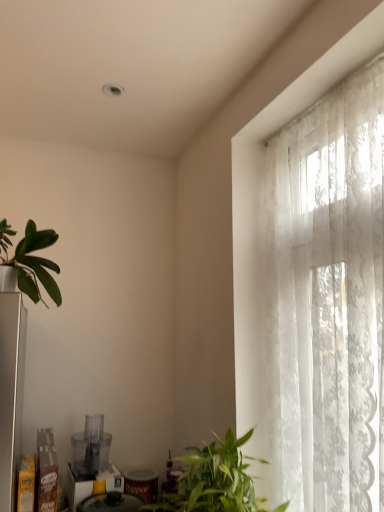
I want to click on transparent plastic food processor at lower left, which appears as the first appliance when viewed from the top, so click(91, 447).

The image size is (384, 512). Find the location of `matte plastic blender at lower left, the first appliance when ordered from bottom to top`. matte plastic blender at lower left, the first appliance when ordered from bottom to top is located at coordinates (92, 463).

What is the approximate height of green matte plant at left, marked as the second houseplant in a bottom-to-top arrangement?

33.61 centimeters.

Describe the element at coordinates (31, 261) in the screenshot. I see `green matte plant at left, the second houseplant when ordered from front to back` at that location.

Identify the location of white lace curtain at right. (327, 301).

Measure the distance between green leafy plant at lower right, placed as the 2th houseplant when sorted from left to right, and camera.

4.01 feet.

This screenshot has width=384, height=512. I want to click on green leafy plant at lower right, which is the first houseplant from front to back, so click(x=213, y=481).

At what (x,y) coordinates should I click in order to perform the action: click on transparent plastic food processor at lower left, which appears as the first appliance when viewed from the top. Please return your answer as a coordinate pair (x, y). The image size is (384, 512). Looking at the image, I should click on (91, 447).

Is green matte plant at left, marked as the second houseplant in a bottom-to-top arrangement, oriented towards transparent plastic food processor at lower left, which is the 2th appliance in bottom-to-top order?

No, green matte plant at left, marked as the second houseplant in a bottom-to-top arrangement, is not turned towards transparent plastic food processor at lower left, which is the 2th appliance in bottom-to-top order.

Considering the sizes of objects green matte plant at left, which is the first houseplant from back to front, and transparent plastic food processor at lower left, which is the 2th appliance in bottom-to-top order, in the image provided, who is taller, green matte plant at left, which is the first houseplant from back to front, or transparent plastic food processor at lower left, which is the 2th appliance in bottom-to-top order,?

green matte plant at left, which is the first houseplant from back to front, is taller.

From the image's perspective, which one is positioned higher, green matte plant at left, which ranks as the 2th houseplant in right-to-left order, or transparent plastic food processor at lower left, which appears as the first appliance when viewed from the top?

green matte plant at left, which ranks as the 2th houseplant in right-to-left order.

Is point (8, 244) in front of point (82, 465)?

Yes, point (8, 244) is in front of point (82, 465).

Between point (50, 239) and point (100, 465), which one is positioned behind?

The point (100, 465) is farther.

From the image's perspective, is green matte plant at left, the 1th houseplant from the left, below matte plastic blender at lower left, the first appliance when ordered from bottom to top?

No, from the image's perspective, green matte plant at left, the 1th houseplant from the left, is not beneath matte plastic blender at lower left, the first appliance when ordered from bottom to top.

Is the depth of white lace curtain at right greater than that of green leafy plant at lower right, which appears as the 1th houseplant when ordered from the bottom?

No, white lace curtain at right is in front of green leafy plant at lower right, which appears as the 1th houseplant when ordered from the bottom.

From the image's perspective, is white lace curtain at right located above or below green leafy plant at lower right, placed as the 2th houseplant when sorted from left to right?

A: Clearly, from the image's perspective, white lace curtain at right is above green leafy plant at lower right, placed as the 2th houseplant when sorted from left to right.

Can you confirm if white lace curtain at right is thinner than green leafy plant at lower right, the 1th houseplant viewed from the right?

Yes.

Does white lace curtain at right touch green leafy plant at lower right, the 1th houseplant viewed from the right?

No, white lace curtain at right is not with green leafy plant at lower right, the 1th houseplant viewed from the right.

Measure the distance from matte plastic blender at lower left, the first appliance when ordered from bottom to top, to green leafy plant at lower right, placed as the 2th houseplant when sorted from left to right.

21.51 inches.

From a real-world perspective, relative to green leafy plant at lower right, placed as the 2th houseplant when sorted from left to right, is matte plastic blender at lower left, which is the second appliance in top-to-bottom order, vertically above or below?

In terms of real-world spatial position, matte plastic blender at lower left, which is the second appliance in top-to-bottom order, is below green leafy plant at lower right, placed as the 2th houseplant when sorted from left to right.

How many degrees apart are the facing directions of matte plastic blender at lower left, the first appliance when ordered from bottom to top, and green leafy plant at lower right, which appears as the 1th houseplant when ordered from the bottom?

94.3 degrees separate the facing orientations of matte plastic blender at lower left, the first appliance when ordered from bottom to top, and green leafy plant at lower right, which appears as the 1th houseplant when ordered from the bottom.

Is matte plastic blender at lower left, the first appliance when ordered from bottom to top, further to camera compared to green leafy plant at lower right, the 1th houseplant viewed from the right?

Yes, matte plastic blender at lower left, the first appliance when ordered from bottom to top, is further from the camera.

Is matte plastic blender at lower left, which is the second appliance in top-to-bottom order, positioned with its back to green matte plant at left, positioned as the 1th houseplant in top-to-bottom order?

That's not correct — matte plastic blender at lower left, which is the second appliance in top-to-bottom order, is not looking away from green matte plant at left, positioned as the 1th houseplant in top-to-bottom order.

Consider the image. Considering the relative positions of matte plastic blender at lower left, the first appliance when ordered from bottom to top, and green matte plant at left, marked as the second houseplant in a bottom-to-top arrangement, in the image provided, is matte plastic blender at lower left, the first appliance when ordered from bottom to top, to the right of green matte plant at left, marked as the second houseplant in a bottom-to-top arrangement, from the viewer's perspective?

Yes, matte plastic blender at lower left, the first appliance when ordered from bottom to top, is to the right of green matte plant at left, marked as the second houseplant in a bottom-to-top arrangement.

Is the surface of matte plastic blender at lower left, the first appliance when ordered from bottom to top, in direct contact with green matte plant at left, which is the first houseplant from back to front?

No, matte plastic blender at lower left, the first appliance when ordered from bottom to top, is not touching green matte plant at left, which is the first houseplant from back to front.

The width and height of the screenshot is (384, 512). I want to click on window on the right of transparent plastic food processor at lower left, which is the 2th appliance in bottom-to-top order, so coord(327,301).

What's the angular difference between white lace curtain at right and transparent plastic food processor at lower left, which appears as the first appliance when viewed from the top,'s facing directions?

90.9 degrees separate the facing orientations of white lace curtain at right and transparent plastic food processor at lower left, which appears as the first appliance when viewed from the top.

Considering the sizes of white lace curtain at right and transparent plastic food processor at lower left, which is the 2th appliance in bottom-to-top order, in the image, is white lace curtain at right taller or shorter than transparent plastic food processor at lower left, which is the 2th appliance in bottom-to-top order,?

white lace curtain at right is taller than transparent plastic food processor at lower left, which is the 2th appliance in bottom-to-top order.

From the image's perspective, relative to green leafy plant at lower right, which is the first houseplant from front to back, is transparent plastic food processor at lower left, which appears as the first appliance when viewed from the top, above or below?

transparent plastic food processor at lower left, which appears as the first appliance when viewed from the top, is situated lower than green leafy plant at lower right, which is the first houseplant from front to back, in the image.

Which is in front, transparent plastic food processor at lower left, which is the 2th appliance in bottom-to-top order, or green leafy plant at lower right, which is the first houseplant from front to back?

green leafy plant at lower right, which is the first houseplant from front to back.

How many degrees apart are the facing directions of transparent plastic food processor at lower left, which is the 2th appliance in bottom-to-top order, and green leafy plant at lower right, the second houseplant in the back-to-front sequence?

There is a 92.2-degree angle between the facing directions of transparent plastic food processor at lower left, which is the 2th appliance in bottom-to-top order, and green leafy plant at lower right, the second houseplant in the back-to-front sequence.

In terms of height, does transparent plastic food processor at lower left, which appears as the first appliance when viewed from the top, look taller or shorter compared to green leafy plant at lower right, which is the first houseplant from front to back?

transparent plastic food processor at lower left, which appears as the first appliance when viewed from the top, is shorter than green leafy plant at lower right, which is the first houseplant from front to back.

From the image's perspective, which houseplant is the 2nd one above the transparent plastic food processor at lower left, which is the 2th appliance in bottom-to-top order? Please provide its 2D coordinates.

[(31, 261)]

Locate an element on the screen. the 2nd appliance located beneath the green matte plant at left, the second houseplant when ordered from front to back (from a real-world perspective) is located at coordinates (92, 463).

Based on their spatial positions, is green matte plant at left, the 1th houseplant from the left, or matte plastic blender at lower left, which is the second appliance in top-to-bottom order, closer to white lace curtain at right?

The object closer to white lace curtain at right is green matte plant at left, the 1th houseplant from the left.

Which object lies further to the anchor point white lace curtain at right, green leafy plant at lower right, the 1th houseplant viewed from the right, or transparent plastic food processor at lower left, which is the 2th appliance in bottom-to-top order?

Based on the image, transparent plastic food processor at lower left, which is the 2th appliance in bottom-to-top order, appears to be further to white lace curtain at right.

From the image, which object appears to be nearer to green leafy plant at lower right, placed as the 2th houseplant when sorted from left to right, white lace curtain at right or matte plastic blender at lower left, the first appliance when ordered from bottom to top?

white lace curtain at right.

Based on their spatial positions, is green matte plant at left, the 1th houseplant from the left, or white lace curtain at right closer to green leafy plant at lower right, the second houseplant in the back-to-front sequence?

Among the two, white lace curtain at right is located nearer to green leafy plant at lower right, the second houseplant in the back-to-front sequence.

Considering their positions, is green matte plant at left, which is the first houseplant from back to front, positioned further to matte plastic blender at lower left, which is the second appliance in top-to-bottom order, than transparent plastic food processor at lower left, which is the 2th appliance in bottom-to-top order?

green matte plant at left, which is the first houseplant from back to front, is positioned further to the anchor matte plastic blender at lower left, which is the second appliance in top-to-bottom order.

Based on their spatial positions, is matte plastic blender at lower left, which is the second appliance in top-to-bottom order, or transparent plastic food processor at lower left, which is the 2th appliance in bottom-to-top order, further from white lace curtain at right?

transparent plastic food processor at lower left, which is the 2th appliance in bottom-to-top order, lies further to white lace curtain at right than the other object.

Considering their positions, is green matte plant at left, positioned as the 1th houseplant in top-to-bottom order, positioned further to transparent plastic food processor at lower left, which appears as the first appliance when viewed from the top, than white lace curtain at right?

Based on the image, white lace curtain at right appears to be further to transparent plastic food processor at lower left, which appears as the first appliance when viewed from the top.

Considering their positions, is matte plastic blender at lower left, the first appliance when ordered from bottom to top, positioned further to green leafy plant at lower right, the second houseplant in the back-to-front sequence, than white lace curtain at right?

The object further to green leafy plant at lower right, the second houseplant in the back-to-front sequence, is matte plastic blender at lower left, the first appliance when ordered from bottom to top.

Identify the location of houseplant situated between green matte plant at left, the second houseplant when ordered from front to back, and white lace curtain at right from left to right. Image resolution: width=384 pixels, height=512 pixels. (213, 481).

Locate an element on the screen. Image resolution: width=384 pixels, height=512 pixels. houseplant between green matte plant at left, marked as the second houseplant in a bottom-to-top arrangement, and matte plastic blender at lower left, the first appliance when ordered from bottom to top, from top to bottom is located at coordinates (213, 481).

At what (x,y) coordinates should I click in order to perform the action: click on houseplant between transparent plastic food processor at lower left, which is the 2th appliance in bottom-to-top order, and white lace curtain at right. Please return your answer as a coordinate pair (x, y). The height and width of the screenshot is (512, 384). Looking at the image, I should click on (213, 481).

Where is `appliance between green leafy plant at lower right, which is the first houseplant from front to back, and transparent plastic food processor at lower left, which appears as the first appliance when viewed from the top, from front to back`? The height and width of the screenshot is (512, 384). appliance between green leafy plant at lower right, which is the first houseplant from front to back, and transparent plastic food processor at lower left, which appears as the first appliance when viewed from the top, from front to back is located at coordinates (92, 463).